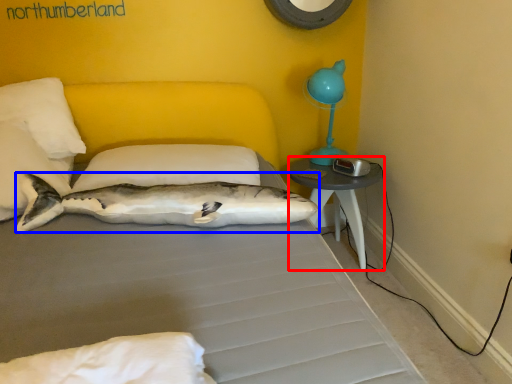
Question: Among these objects, which one is nearest to the camera, nightstand (highlighted by a red box) or shark (highlighted by a blue box)?

Choices:
 (A) nightstand
 (B) shark

Answer: (B)